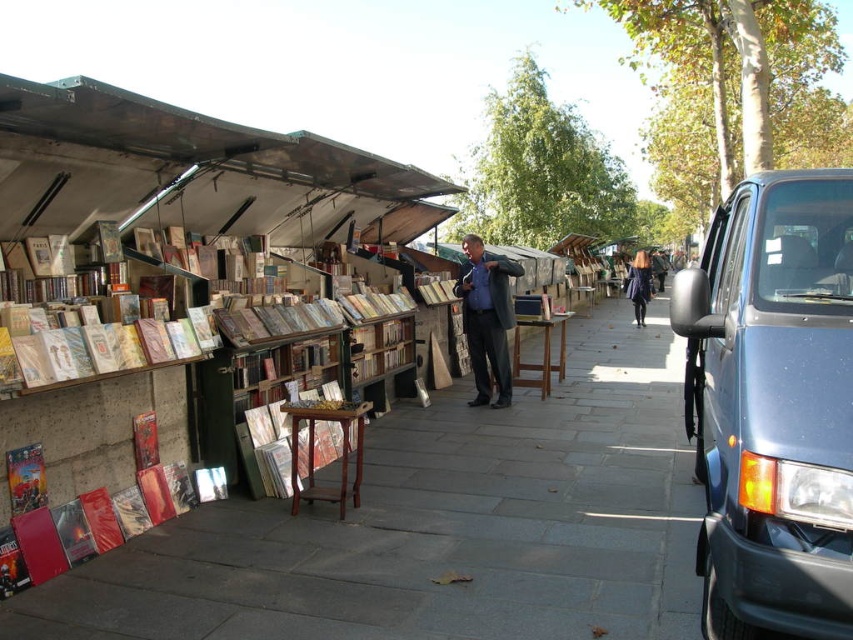
Between red glossy book at lower left and dark blue coat at center, which one is positioned higher?

Positioned higher is dark blue coat at center.

Which is in front, point (20, 536) or point (639, 276)?

Point (20, 536) is more forward.

The height and width of the screenshot is (640, 853). Describe the element at coordinates (96, 516) in the screenshot. I see `red glossy book at lower left` at that location.

At what (x,y) coordinates should I click in order to perform the action: click on red glossy book at lower left. Please return your answer as a coordinate pair (x, y). Looking at the image, I should click on (96, 516).

Between metallic blue van at right and dark blue coat at center, which one is positioned higher?

dark blue coat at center is higher up.

Is point (715, 385) positioned in front of point (636, 257)?

That is True.

Between point (769, 454) and point (637, 304), which one is positioned behind?

Point (637, 304)

The image size is (853, 640). Identify the location of metallic blue van at right. (772, 404).

The width and height of the screenshot is (853, 640). Find the location of `metallic blue van at right`. metallic blue van at right is located at coordinates (772, 404).

How far apart are metallic blue van at right and blue fabric jacket at center?

metallic blue van at right is 4.05 meters away from blue fabric jacket at center.

Find the location of a particular element. The width and height of the screenshot is (853, 640). metallic blue van at right is located at coordinates (772, 404).

Identify the location of metallic blue van at right. (772, 404).